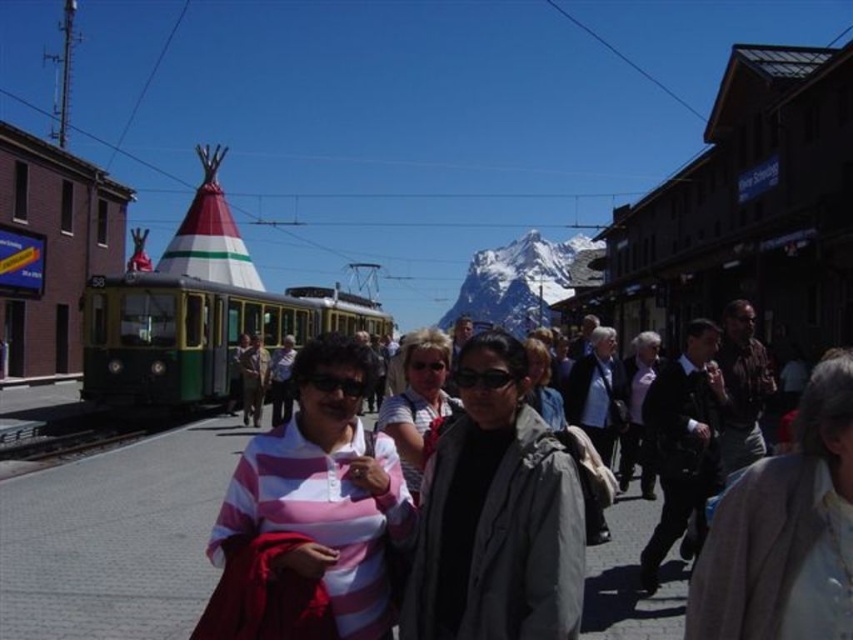
Question: Estimate the real-world distances between objects in this image. Which object is closer to the green matte train at left?

Choices:
 (A) pink striped shirt at center
 (B) gray matte jacket at center
 (C) matte black jacket at center

Answer: (C)

Question: Among these points, which one is farthest from the camera?

Choices:
 (A) (778, 552)
 (B) (309, 612)

Answer: (B)

Question: Does pink striped shirt at center have a lesser width compared to gray matte jacket at center?

Choices:
 (A) no
 (B) yes

Answer: (A)

Question: Can you confirm if matte black jacket at center is positioned to the right of matte gray jacket at center?

Choices:
 (A) yes
 (B) no

Answer: (B)

Question: Is pink striped shirt at center thinner than white snow-covered mountain at center?

Choices:
 (A) yes
 (B) no

Answer: (A)

Question: Based on their relative distances, which object is nearer to the gray matte jacket at center?

Choices:
 (A) gray fabric jacket at center
 (B) green matte train at left
 (C) matte black jacket at center

Answer: (C)